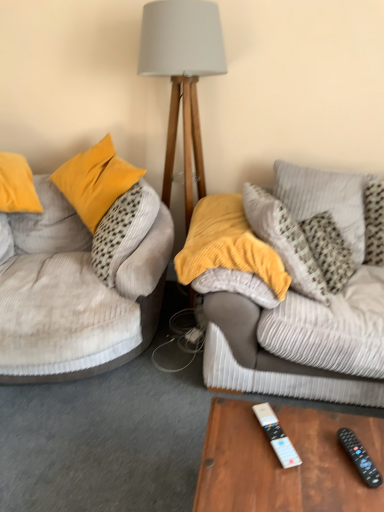
The image size is (384, 512). I want to click on corduroy pillow at upper right, arranged as the second pillow when viewed from the left, so click(325, 199).

Locate an element on the screen. This screenshot has width=384, height=512. velvety yellow pillow at center, which is the first pillow from left to right is located at coordinates (228, 245).

Locate an element on the screen. white plastic remote control at lower center, which is counted as the first remote control, starting from the left is located at coordinates pos(276,436).

The height and width of the screenshot is (512, 384). Find the location of `black plastic remote control at lower right, positioned as the 2th remote control in left-to-right order`. black plastic remote control at lower right, positioned as the 2th remote control in left-to-right order is located at coordinates (359, 457).

I want to click on wooden table at lower center, so click(280, 463).

Find the location of a particular element. light gray fabric lampshade at center is located at coordinates (182, 76).

Find the location of a particular element. This screenshot has height=512, width=384. velvet beige couch at left is located at coordinates (75, 295).

Is velvet beige couch at left situated inside corduroy pillow at upper right, acting as the first pillow starting from the right, or outside?

velvet beige couch at left is outside corduroy pillow at upper right, acting as the first pillow starting from the right.

From the image's perspective, is velvet beige couch at left located above or below corduroy pillow at upper right, arranged as the second pillow when viewed from the left?

Based on their image positions, velvet beige couch at left is located beneath corduroy pillow at upper right, arranged as the second pillow when viewed from the left.

Does point (27, 269) come in front of point (337, 216)?

Yes, it is in front of point (337, 216).

Is corduroy pillow at upper right, acting as the first pillow starting from the right, far from black plastic remote control at lower right, the first remote control when ordered from right to left?

corduroy pillow at upper right, acting as the first pillow starting from the right, is positioned a significant distance from black plastic remote control at lower right, the first remote control when ordered from right to left.

From a real-world perspective, does corduroy pillow at upper right, acting as the first pillow starting from the right, sit lower than black plastic remote control at lower right, the first remote control when ordered from right to left?

Actually, corduroy pillow at upper right, acting as the first pillow starting from the right, is physically above black plastic remote control at lower right, the first remote control when ordered from right to left, in the real world.

Does corduroy pillow at upper right, acting as the first pillow starting from the right, turn towards black plastic remote control at lower right, the first remote control when ordered from right to left?

Yes.

Is point (364, 248) farther from camera compared to point (370, 479)?

Yes, it is.

Would you say black plastic remote control at lower right, positioned as the 2th remote control in left-to-right order, is to the left or to the right of wooden table at lower center in the picture?

Clearly, black plastic remote control at lower right, positioned as the 2th remote control in left-to-right order, is on the right of wooden table at lower center in the image.

From the image's perspective, which object appears higher, black plastic remote control at lower right, positioned as the 2th remote control in left-to-right order, or wooden table at lower center?

black plastic remote control at lower right, positioned as the 2th remote control in left-to-right order.

Based on the photo, considering the relative sizes of black plastic remote control at lower right, the first remote control when ordered from right to left, and wooden table at lower center in the image provided, is black plastic remote control at lower right, the first remote control when ordered from right to left, bigger than wooden table at lower center?

No, black plastic remote control at lower right, the first remote control when ordered from right to left, is not bigger than wooden table at lower center.

From a real-world perspective, is black plastic remote control at lower right, the first remote control when ordered from right to left, positioned under wooden table at lower center based on gravity?

No, from a real-world perspective, black plastic remote control at lower right, the first remote control when ordered from right to left, is not beneath wooden table at lower center.

Considering the relative sizes of velvet beige couch at left and wooden table at lower center in the image provided, is velvet beige couch at left shorter than wooden table at lower center?

No.

From a real-world perspective, between velvet beige couch at left and wooden table at lower center, who is vertically higher?

From a 3D spatial view, velvet beige couch at left is above.

Would you say wooden table at lower center is part of velvet beige couch at left's contents?

No, wooden table at lower center is not inside velvet beige couch at left.

What's the angular difference between velvet beige couch at left and wooden table at lower center's facing directions?

105 degrees separate the facing orientations of velvet beige couch at left and wooden table at lower center.

In order to click on table that is under the light gray fabric lampshade at center (from a real-world perspective) in this screenshot , I will do `click(280, 463)`.

Consider the image. Are wooden table at lower center and light gray fabric lampshade at center making contact?

No, wooden table at lower center is not next to light gray fabric lampshade at center.

Considering the sizes of objects wooden table at lower center and light gray fabric lampshade at center in the image provided, who is thinner, wooden table at lower center or light gray fabric lampshade at center?

light gray fabric lampshade at center is thinner.

Considering the relative positions of wooden table at lower center and light gray fabric lampshade at center in the image provided, is wooden table at lower center behind light gray fabric lampshade at center?

No, the depth of wooden table at lower center is less than that of light gray fabric lampshade at center.

Can you see velvety yellow pillow at center, the second pillow from the right, touching corduroy pillow at upper right, arranged as the second pillow when viewed from the left?

velvety yellow pillow at center, the second pillow from the right, and corduroy pillow at upper right, arranged as the second pillow when viewed from the left, are not in contact.

From a real-world perspective, is velvety yellow pillow at center, the second pillow from the right, positioned over corduroy pillow at upper right, acting as the first pillow starting from the right, based on gravity?

Correct, in the physical world, velvety yellow pillow at center, the second pillow from the right, is higher than corduroy pillow at upper right, acting as the first pillow starting from the right.

Is velvety yellow pillow at center, the second pillow from the right, oriented away from corduroy pillow at upper right, acting as the first pillow starting from the right?

No, velvety yellow pillow at center, the second pillow from the right,'s orientation is not away from corduroy pillow at upper right, acting as the first pillow starting from the right.

Consider the image. Considering the relative sizes of velvety yellow pillow at center, the second pillow from the right, and corduroy pillow at upper right, acting as the first pillow starting from the right, in the image provided, is velvety yellow pillow at center, the second pillow from the right, shorter than corduroy pillow at upper right, acting as the first pillow starting from the right,?

Indeed, velvety yellow pillow at center, the second pillow from the right, has a lesser height compared to corduroy pillow at upper right, acting as the first pillow starting from the right.

From a real-world perspective, is wooden table at lower center located higher than velvety yellow pillow at center, the second pillow from the right?

Actually, wooden table at lower center is physically below velvety yellow pillow at center, the second pillow from the right, in the real world.

Considering the relative positions of wooden table at lower center and velvety yellow pillow at center, the second pillow from the right, in the image provided, is wooden table at lower center to the left of velvety yellow pillow at center, the second pillow from the right, from the viewer's perspective?

No.

Are wooden table at lower center and velvety yellow pillow at center, the second pillow from the right, far apart?

That's not correct — wooden table at lower center is a little close to velvety yellow pillow at center, the second pillow from the right.

Could you tell me if wooden table at lower center is turned towards velvety yellow pillow at center, which is the first pillow from left to right?

No, wooden table at lower center is not aimed at velvety yellow pillow at center, which is the first pillow from left to right.

Where is `studio couch in front of the corduroy pillow at upper right, arranged as the second pillow when viewed from the left`? The image size is (384, 512). studio couch in front of the corduroy pillow at upper right, arranged as the second pillow when viewed from the left is located at coordinates (75, 295).

Identify the location of remote control that is the 2nd one when counting downward from the corduroy pillow at upper right, arranged as the second pillow when viewed from the left (from the image's perspective). (359, 457).

From the image, which object appears to be nearer to white plastic remote control at lower center, which appears as the second remote control when viewed from the right, black plastic remote control at lower right, positioned as the 2th remote control in left-to-right order, or wooden table at lower center?

wooden table at lower center.

From the image, which object appears to be nearer to wooden table at lower center, light gray fabric lampshade at center or velvety yellow pillow at center, the second pillow from the right?

velvety yellow pillow at center, the second pillow from the right, is closer to wooden table at lower center.

Looking at the image, which one is located further to wooden table at lower center, velvet beige couch at left or corduroy pillow at upper right, acting as the first pillow starting from the right?

Among the two, corduroy pillow at upper right, acting as the first pillow starting from the right, is located further to wooden table at lower center.

Based on their spatial positions, is white plastic remote control at lower center, which appears as the second remote control when viewed from the right, or corduroy pillow at upper right, arranged as the second pillow when viewed from the left, further from light gray fabric lampshade at center?

The object further to light gray fabric lampshade at center is white plastic remote control at lower center, which appears as the second remote control when viewed from the right.

When comparing their distances from wooden table at lower center, does black plastic remote control at lower right, the first remote control when ordered from right to left, or velvet beige couch at left seem closer?

black plastic remote control at lower right, the first remote control when ordered from right to left, is closer to wooden table at lower center.

From the image, which object appears to be farther from black plastic remote control at lower right, positioned as the 2th remote control in left-to-right order, corduroy pillow at upper right, arranged as the second pillow when viewed from the left, or light gray fabric lampshade at center?

The object further to black plastic remote control at lower right, positioned as the 2th remote control in left-to-right order, is light gray fabric lampshade at center.

Which object lies nearer to the anchor point black plastic remote control at lower right, the first remote control when ordered from right to left, corduroy pillow at upper right, arranged as the second pillow when viewed from the left, or velvet beige couch at left?

velvet beige couch at left lies closer to black plastic remote control at lower right, the first remote control when ordered from right to left, than the other object.

Based on their spatial positions, is corduroy pillow at upper right, acting as the first pillow starting from the right, or wooden table at lower center further from velvety yellow pillow at center, which is the first pillow from left to right?

Among the two, wooden table at lower center is located further to velvety yellow pillow at center, which is the first pillow from left to right.

Where is `table lamp between velvet beige couch at left and corduroy pillow at upper right, acting as the first pillow starting from the right`? This screenshot has height=512, width=384. table lamp between velvet beige couch at left and corduroy pillow at upper right, acting as the first pillow starting from the right is located at coordinates (182, 76).

Find the location of a particular element. remote control between velvet beige couch at left and black plastic remote control at lower right, the first remote control when ordered from right to left, from left to right is located at coordinates (276, 436).

The image size is (384, 512). I want to click on pillow situated between velvet beige couch at left and wooden table at lower center from left to right, so click(228, 245).

Where is `pillow positioned between white plastic remote control at lower center, which appears as the second remote control when viewed from the right, and corduroy pillow at upper right, acting as the first pillow starting from the right, from near to far`? The width and height of the screenshot is (384, 512). pillow positioned between white plastic remote control at lower center, which appears as the second remote control when viewed from the right, and corduroy pillow at upper right, acting as the first pillow starting from the right, from near to far is located at coordinates (228, 245).